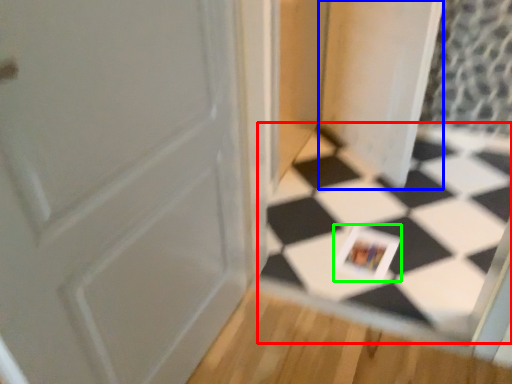
Question: Which object is the closest to the square (highlighted by a red box)? Choose among these: screen door (highlighted by a blue box) or postcard (highlighted by a green box).

Choices:
 (A) screen door
 (B) postcard

Answer: (B)